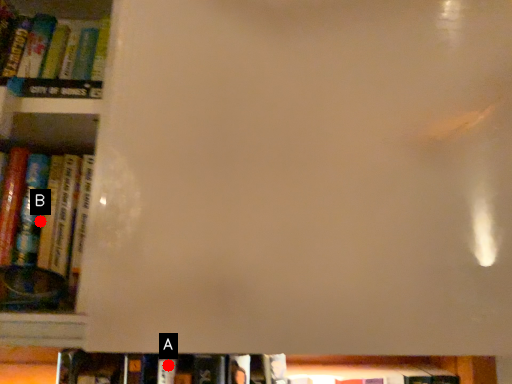
Question: Two points are circled on the image, labeled by A and B beside each circle. Which point is closer to the camera taking this photo?

Choices:
 (A) A is closer
 (B) B is closer

Answer: (B)